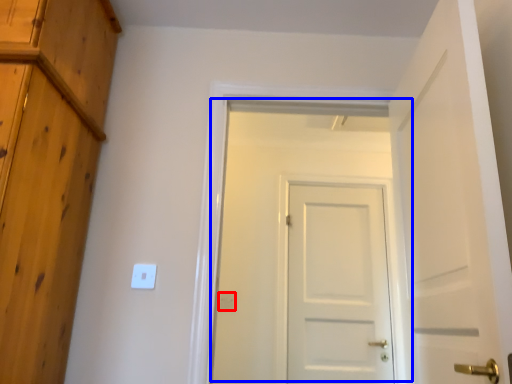
Question: Which of the following is the closest to the observer, electric outlet (highlighted by a red box) or door (highlighted by a blue box)?

Choices:
 (A) electric outlet
 (B) door

Answer: (B)